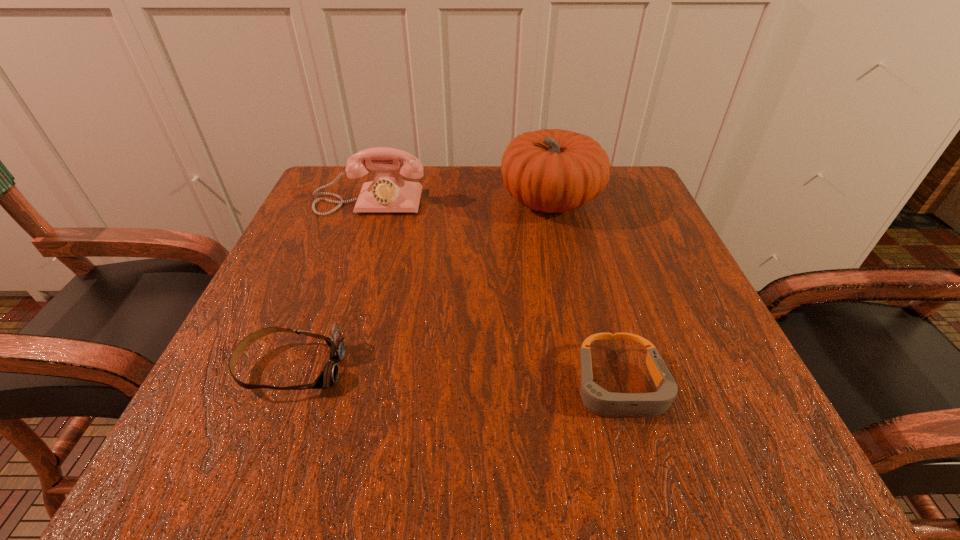
Locate an element on the screen. Image resolution: width=960 pixels, height=540 pixels. blank space at the right edge of the desktop is located at coordinates (649, 268).

Find the location of a particular element. The image size is (960, 540). free space at the far left corner of the desktop is located at coordinates [x=323, y=215].

Locate an element on the screen. blank space at the near left corner is located at coordinates (257, 417).

Where is `vacant region at the far right corner of the desktop`? The width and height of the screenshot is (960, 540). vacant region at the far right corner of the desktop is located at coordinates (627, 217).

This screenshot has height=540, width=960. I want to click on vacant position at the near right corner of the desktop, so click(x=777, y=478).

You are a GUI agent. You are given a task and a screenshot of the screen. Output one action in this format:
    pyautogui.click(x=<x>, y=<y>)
    Task: Click on the empty location between the right goggles and the second tallest object
    The width and height of the screenshot is (960, 540).
    Given the screenshot: What is the action you would take?
    pyautogui.click(x=494, y=294)

Where is `free spot between the second tallest object and the right goggles`? The image size is (960, 540). free spot between the second tallest object and the right goggles is located at coordinates (494, 294).

At what (x,y) coordinates should I click in order to perform the action: click on blank region between the left goggles and the right goggles. Please return your answer as a coordinate pair (x, y). This screenshot has width=960, height=540. Looking at the image, I should click on (455, 377).

Locate an element on the screen. The height and width of the screenshot is (540, 960). unoccupied position between the right goggles and the second tallest object is located at coordinates (494, 294).

Where is `blank region between the telephone and the pumpkin`? The image size is (960, 540). blank region between the telephone and the pumpkin is located at coordinates click(460, 201).